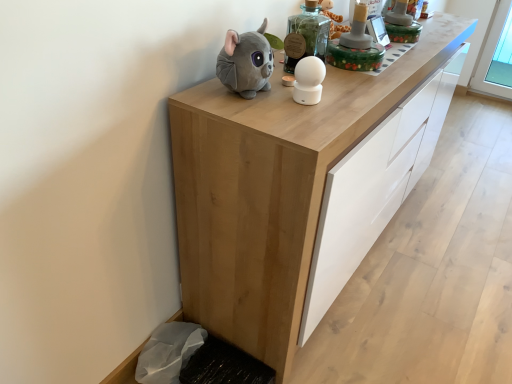
Identify the location of vacant area that lies to the right of soft gray plush toy at upper center, marked as the second toy in a right-to-left arrangement. The height and width of the screenshot is (384, 512). (328, 99).